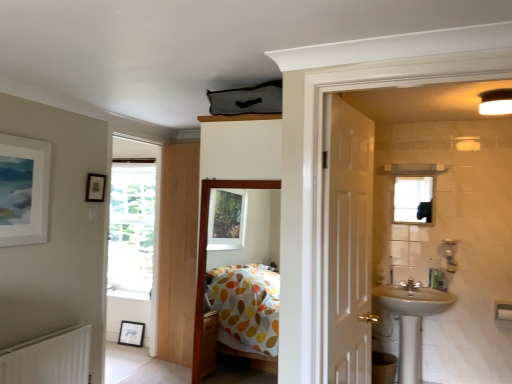
Question: Considering the relative sizes of black matte picture frame at lower left, marked as the 3th picture frame in a front-to-back arrangement, and matte black picture frame at upper left, which is the third picture frame in bottom-to-top order, in the image provided, is black matte picture frame at lower left, marked as the 3th picture frame in a front-to-back arrangement, smaller than matte black picture frame at upper left, which is the third picture frame in bottom-to-top order,?

Choices:
 (A) yes
 (B) no

Answer: (B)

Question: Does black matte picture frame at lower left, the third picture frame positioned from the top, have a lesser width compared to matte black picture frame at upper left, the 2th picture frame viewed from the front?

Choices:
 (A) no
 (B) yes

Answer: (A)

Question: Is black matte picture frame at lower left, positioned as the 1th picture frame in bottom-to-top order, positioned before matte black picture frame at upper left, which is the third picture frame in bottom-to-top order?

Choices:
 (A) no
 (B) yes

Answer: (A)

Question: Is black matte picture frame at lower left, marked as the 3th picture frame in a front-to-back arrangement, to the right of matte black picture frame at upper left, the first picture frame when ordered from top to bottom, from the viewer's perspective?

Choices:
 (A) yes
 (B) no

Answer: (B)

Question: Is black matte picture frame at lower left, which is the first picture frame in back-to-front order, to the left of matte black picture frame at upper left, the 2th picture frame viewed from the front, from the viewer's perspective?

Choices:
 (A) no
 (B) yes

Answer: (B)

Question: From the image's perspective, is black matte picture frame at lower left, marked as the 3th picture frame in a front-to-back arrangement, beneath matte black picture frame at upper left, the first picture frame when ordered from top to bottom?

Choices:
 (A) no
 (B) yes

Answer: (B)

Question: Is clear glass mirror at upper right taller than silver metallic tap at right?

Choices:
 (A) yes
 (B) no

Answer: (A)

Question: Is clear glass mirror at upper right in contact with silver metallic tap at right?

Choices:
 (A) no
 (B) yes

Answer: (A)

Question: Can you confirm if clear glass mirror at upper right is positioned to the right of silver metallic tap at right?

Choices:
 (A) no
 (B) yes

Answer: (B)

Question: Is clear glass mirror at upper right facing away from silver metallic tap at right?

Choices:
 (A) yes
 (B) no

Answer: (B)

Question: Does clear glass mirror at upper right have a larger size compared to silver metallic tap at right?

Choices:
 (A) no
 (B) yes

Answer: (B)

Question: Is clear glass mirror at upper right not near silver metallic tap at right?

Choices:
 (A) no
 (B) yes

Answer: (A)

Question: Does polka dot fabric bed at center lie behind silver metallic tap at right?

Choices:
 (A) yes
 (B) no

Answer: (B)